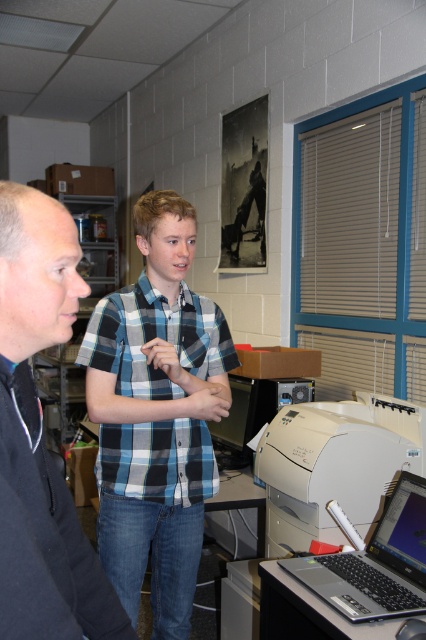
You are standing at the point closest to the wall in the office scene. There are two points marked in the image, one at coordinates point (184,461) and another at point (385,522). Which of these points is farther away from you?

Point (184,461) is behind point (385,522), so if you are standing at the point closest to the wall, the point farther away from you would be point (184,461).

You are a delivery person who needs to hand over a package to the person wearing the blue plaid shirt at center. The package is too large to place on the shiny black laptop at lower right. Where should you place it instead?

Since the shiny black laptop at lower right is behind the blue plaid shirt at center, you should place the package in front of the blue plaid shirt at center where there is space available.

You are an office worker who needs to reach the white matte printer at lower right without moving the blue plaid shirt at center. Is this possible?

The blue plaid shirt at center is located above the white matte printer at lower right, so you can access the white matte printer at lower right by moving around the blue plaid shirt at center since it is positioned above and not blocking the path.